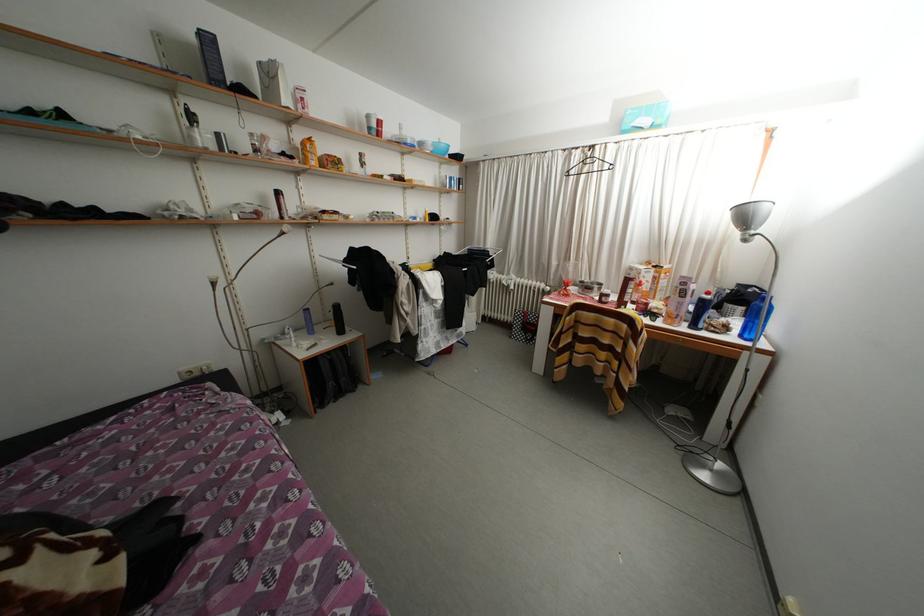
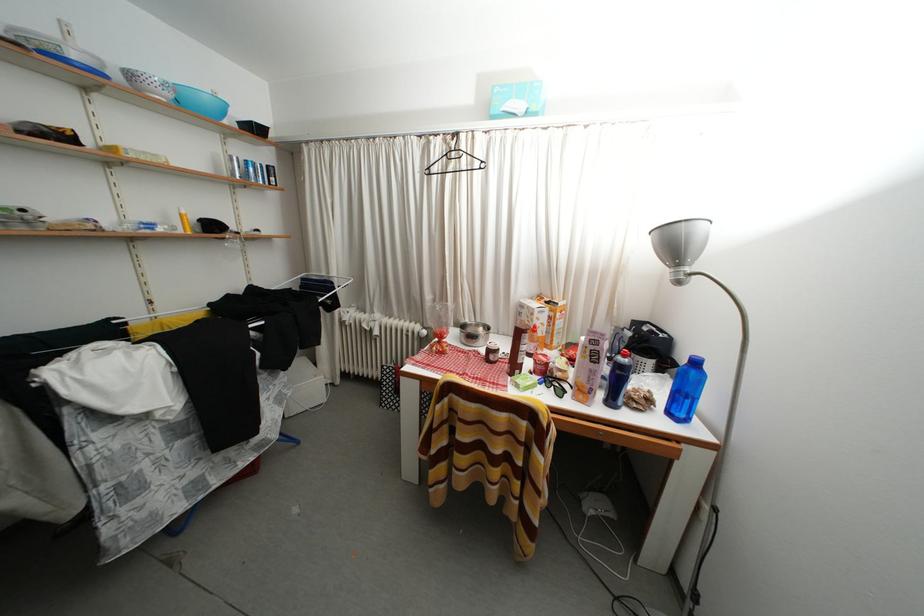
Find the pixel in the second image that matches (x=592, y=175) in the first image.

(458, 172)